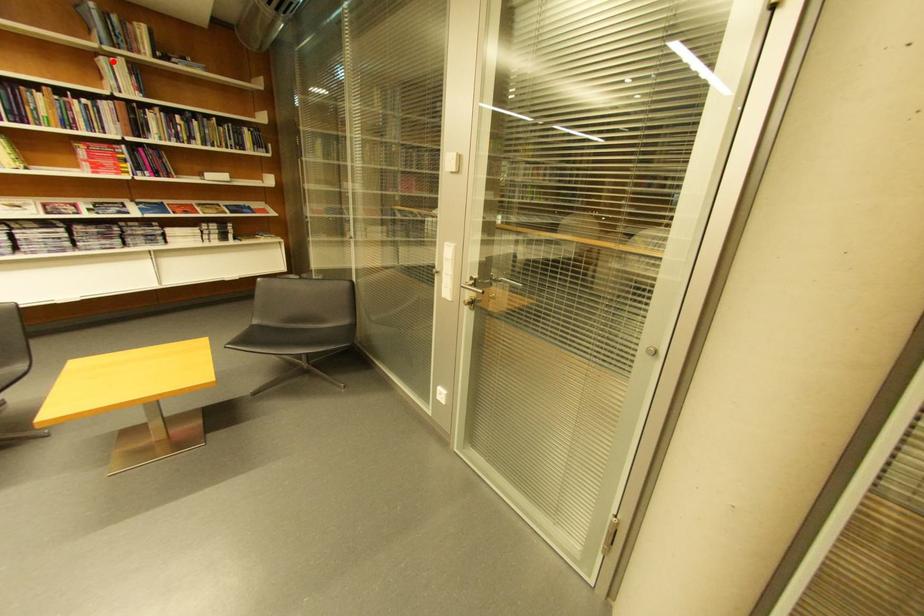
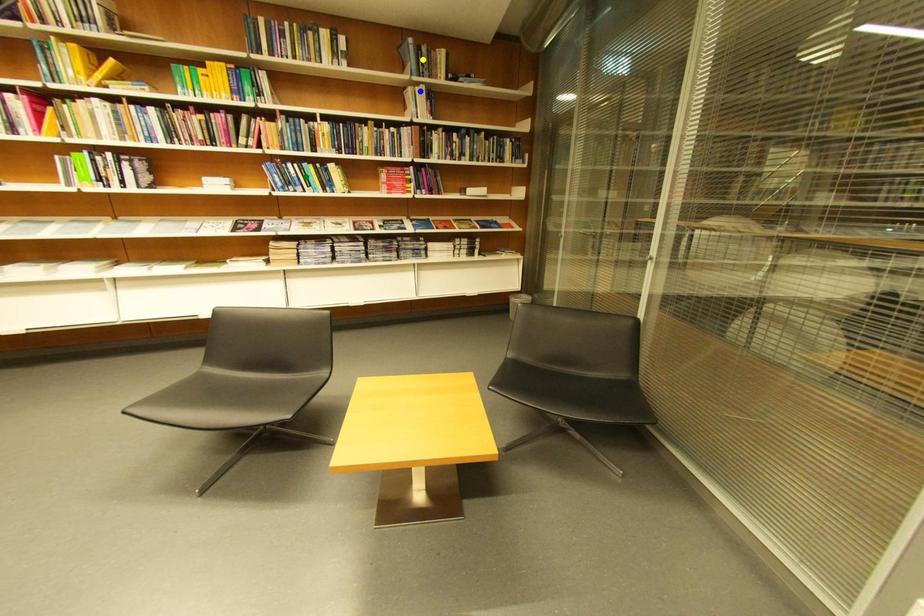
Question: I am providing you with two images of the same scene from different viewpoints. A red point is marked on the first image. You are given multiple points on the second image. Which mark in image 2 goes with the point in image 1?

Choices:
 (A) yellow point
 (B) green point
 (C) blue point

Answer: (C)